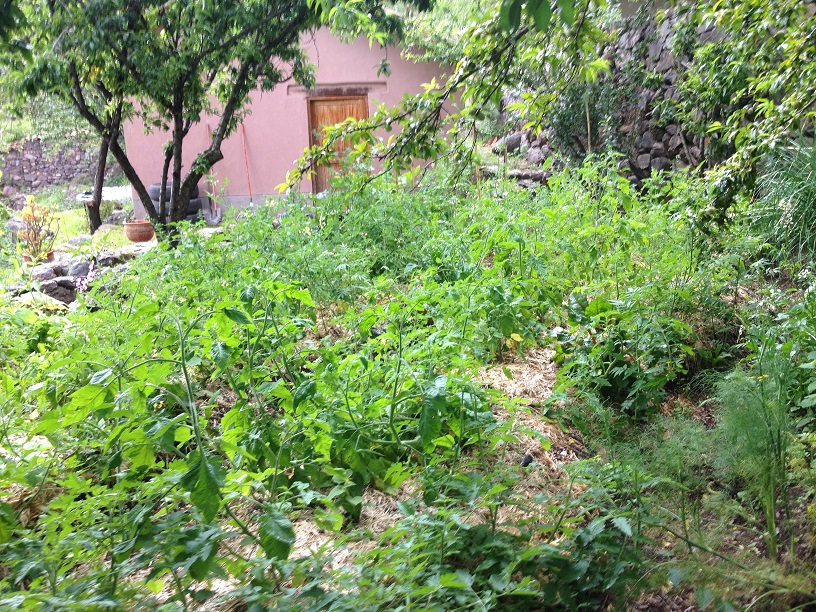
Find the location of `door`. door is located at coordinates (331, 112).